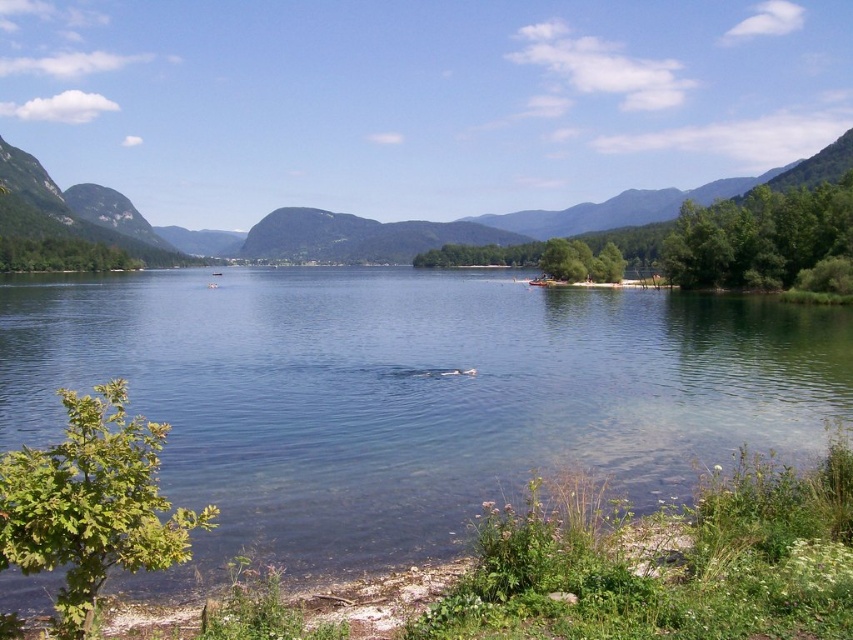
You are a GUI agent. You are given a task and a screenshot of the screen. Output one action in this format:
    pyautogui.click(x=<x>, y=<y>)
    Task: Click on the clear blue water at center
    The image size is (853, 640).
    Given the screenshot: What is the action you would take?
    pyautogui.click(x=410, y=396)

The width and height of the screenshot is (853, 640). I want to click on clear blue water at center, so click(410, 396).

At what (x,y) coordinates should I click in order to perform the action: click on clear blue water at center. Please return your answer as a coordinate pair (x, y). The image size is (853, 640). Looking at the image, I should click on (410, 396).